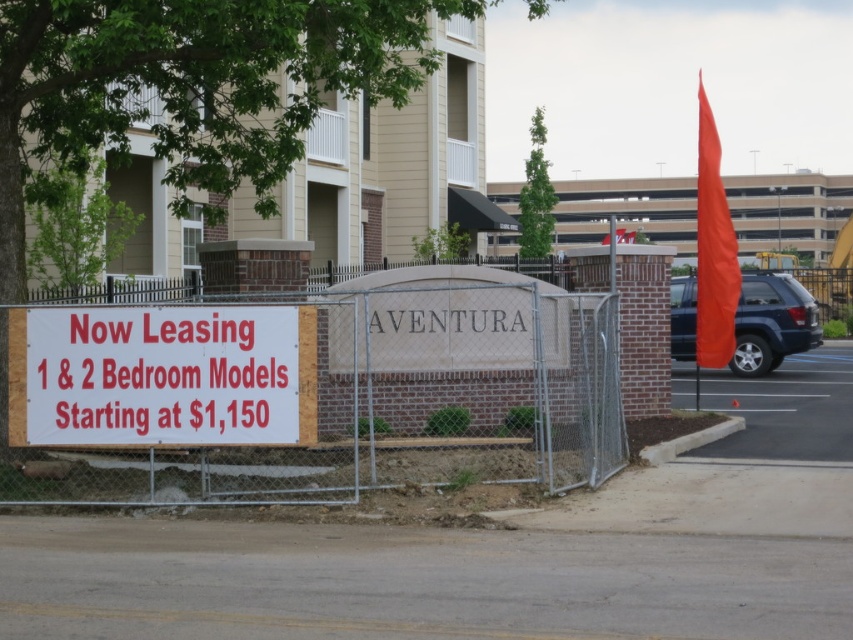
How much distance is there between metal chain-link fence at center and white paper sign at center?

metal chain-link fence at center is 24.05 inches from white paper sign at center.

Is metal chain-link fence at center above white paper sign at center?

Incorrect, metal chain-link fence at center is not positioned above white paper sign at center.

Between point (613, 316) and point (199, 397), which one is positioned in front?

Point (199, 397)

Where is `metal chain-link fence at center`? The height and width of the screenshot is (640, 853). metal chain-link fence at center is located at coordinates (320, 394).